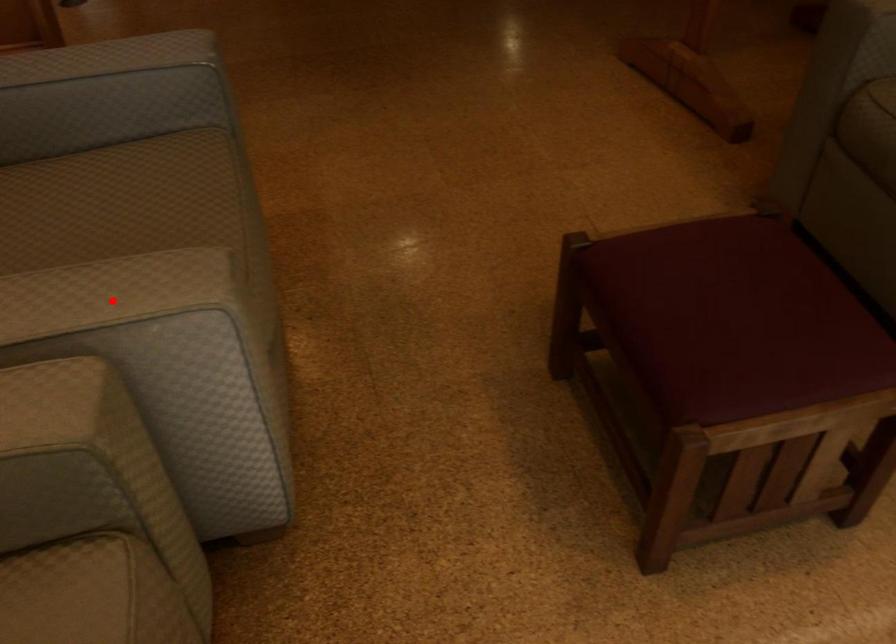
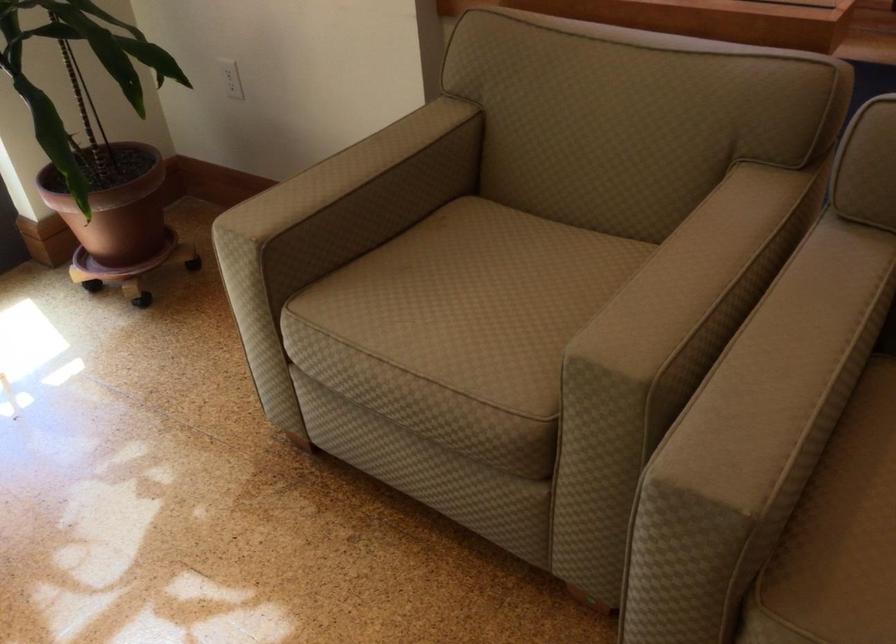
The point at the highlighted location is marked in the first image. Where is the corresponding point in the second image?

(862, 504)